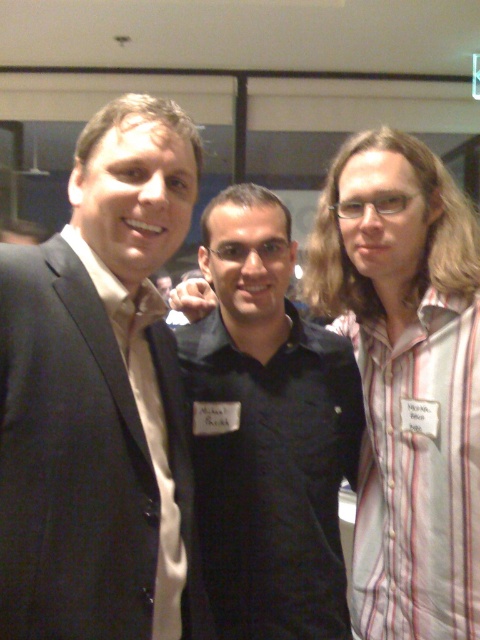
Question: Does black matte shirt at center lie behind matte gold tie at left?

Choices:
 (A) yes
 (B) no

Answer: (A)

Question: From the image, what is the correct spatial relationship of black matte shirt at center in relation to matte gold tie at left?

Choices:
 (A) left
 (B) right

Answer: (B)

Question: Estimate the real-world distances between objects in this image. Which object is farther from the matte gold tie at left?

Choices:
 (A) black matte shirt at center
 (B) matte black suit at left

Answer: (A)

Question: Estimate the real-world distances between objects in this image. Which object is closer to the black matte shirt at center?

Choices:
 (A) matte black suit at left
 (B) matte gold tie at left

Answer: (A)

Question: Is black matte shirt at center above matte gold tie at left?

Choices:
 (A) no
 (B) yes

Answer: (B)

Question: Estimate the real-world distances between objects in this image. Which object is closer to the matte gold tie at left?

Choices:
 (A) black matte shirt at center
 (B) matte black suit at left

Answer: (B)